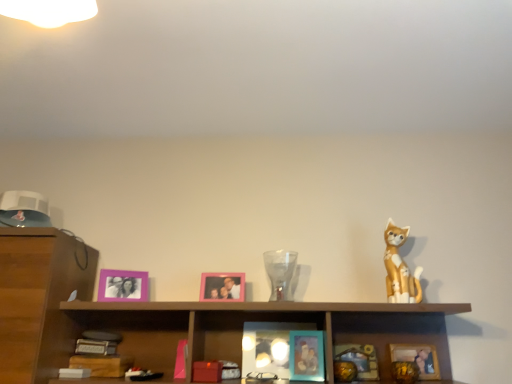
The width and height of the screenshot is (512, 384). Describe the element at coordinates (222, 286) in the screenshot. I see `pink matte picture frame at center, acting as the 2th picture frame starting from the left` at that location.

Where is `transparent glass vase at center`? This screenshot has height=384, width=512. transparent glass vase at center is located at coordinates (280, 273).

You are a GUI agent. You are given a task and a screenshot of the screen. Output one action in this format:
    pyautogui.click(x=<x>, y=<y>)
    Task: Click on the teal matte picture frame at lower center, marked as the 2th picture frame in a right-to-left arrangement
    The width and height of the screenshot is (512, 384).
    Given the screenshot: What is the action you would take?
    [359, 359]

Looking at this image, how much space does teal matte picture frame at lower center, marked as the 2th picture frame in a right-to-left arrangement, occupy vertically?

teal matte picture frame at lower center, marked as the 2th picture frame in a right-to-left arrangement, is 5.95 inches in height.

Based on the photo, what is the approximate width of matte orange cat figurine at right?

matte orange cat figurine at right is 3.23 inches wide.

The height and width of the screenshot is (384, 512). I want to click on pink matte picture frame at center, which is counted as the fourth picture frame, starting from the right, so click(222, 286).

Which of these two, pink matte picture frame at center, acting as the 2th picture frame starting from the left, or wooden picture frame at lower right, the first picture frame in the right-to-left sequence, is bigger?

wooden picture frame at lower right, the first picture frame in the right-to-left sequence.

Visually, is pink matte picture frame at center, which is counted as the fourth picture frame, starting from the right, positioned to the left or to the right of wooden picture frame at lower right, which appears as the 5th picture frame when viewed from the left?

In the image, pink matte picture frame at center, which is counted as the fourth picture frame, starting from the right, appears on the left side of wooden picture frame at lower right, which appears as the 5th picture frame when viewed from the left.

Considering the positions of point (237, 293) and point (430, 378), is point (237, 293) closer or farther from the camera than point (430, 378)?

Clearly, point (237, 293) is more distant from the camera than point (430, 378).

Considering the relative sizes of pink matte picture frame at center, which is counted as the fourth picture frame, starting from the right, and wooden picture frame at lower right, the first picture frame in the right-to-left sequence, in the image provided, is pink matte picture frame at center, which is counted as the fourth picture frame, starting from the right, taller than wooden picture frame at lower right, the first picture frame in the right-to-left sequence,?

No.

From the image's perspective, would you say teal matte picture frame at lower center, marked as the 2th picture frame in a right-to-left arrangement, is shown under transparent glass vase at center?

Correct, teal matte picture frame at lower center, marked as the 2th picture frame in a right-to-left arrangement, appears lower than transparent glass vase at center in the image.

Is the position of teal matte picture frame at lower center, which is counted as the 4th picture frame, starting from the left, less distant than that of transparent glass vase at center?

No.

Based on the photo, between teal matte picture frame at lower center, which is counted as the 4th picture frame, starting from the left, and transparent glass vase at center, which one has smaller width?

With smaller width is teal matte picture frame at lower center, which is counted as the 4th picture frame, starting from the left.

Is pink matte picture frame at center, acting as the 2th picture frame starting from the left, to the left or to the right of matte orange cat figurine at right in the image?

Clearly, pink matte picture frame at center, acting as the 2th picture frame starting from the left, is on the left of matte orange cat figurine at right in the image.

From a real-world perspective, who is located higher, pink matte picture frame at center, which is counted as the fourth picture frame, starting from the right, or matte orange cat figurine at right?

matte orange cat figurine at right.

Can you confirm if pink matte picture frame at center, acting as the 2th picture frame starting from the left, is wider than matte orange cat figurine at right?

In fact, pink matte picture frame at center, acting as the 2th picture frame starting from the left, might be narrower than matte orange cat figurine at right.

Is teal glossy picture frame at center, the third picture frame positioned from the right, looking in the opposite direction of purple matte picture frame at upper left, arranged as the first picture frame when viewed from the left?

teal glossy picture frame at center, the third picture frame positioned from the right, is not turned away from purple matte picture frame at upper left, arranged as the first picture frame when viewed from the left.

Is teal glossy picture frame at center, positioned as the third picture frame in left-to-right order, further to the viewer compared to purple matte picture frame at upper left, the fifth picture frame positioned from the right?

No, teal glossy picture frame at center, positioned as the third picture frame in left-to-right order, is in front of purple matte picture frame at upper left, the fifth picture frame positioned from the right.

Between teal glossy picture frame at center, positioned as the third picture frame in left-to-right order, and purple matte picture frame at upper left, the fifth picture frame positioned from the right, which one has larger width?

teal glossy picture frame at center, positioned as the third picture frame in left-to-right order, is wider.

From the image's perspective, is teal glossy picture frame at center, the third picture frame positioned from the right, under purple matte picture frame at upper left, arranged as the first picture frame when viewed from the left?

Yes, from the image's perspective, teal glossy picture frame at center, the third picture frame positioned from the right, is below purple matte picture frame at upper left, arranged as the first picture frame when viewed from the left.

Considering the sizes of objects teal matte picture frame at lower center, marked as the 2th picture frame in a right-to-left arrangement, and matte orange cat figurine at right in the image provided, who is bigger, teal matte picture frame at lower center, marked as the 2th picture frame in a right-to-left arrangement, or matte orange cat figurine at right?

matte orange cat figurine at right.

Could you tell me if teal matte picture frame at lower center, which is counted as the 4th picture frame, starting from the left, is turned towards matte orange cat figurine at right?

No, teal matte picture frame at lower center, which is counted as the 4th picture frame, starting from the left, does not turn towards matte orange cat figurine at right.

Between teal matte picture frame at lower center, marked as the 2th picture frame in a right-to-left arrangement, and matte orange cat figurine at right, which one has larger width?

Wider between the two is matte orange cat figurine at right.

Which object is further away from the camera taking this photo, teal matte picture frame at lower center, which is counted as the 4th picture frame, starting from the left, or matte orange cat figurine at right?

teal matte picture frame at lower center, which is counted as the 4th picture frame, starting from the left, is further from the camera.

Is teal glossy picture frame at center, positioned as the third picture frame in left-to-right order, at the back of transparent glass vase at center?

No, transparent glass vase at center is not facing the opposite direction of teal glossy picture frame at center, positioned as the third picture frame in left-to-right order.

Which object is further away from the camera, transparent glass vase at center or teal glossy picture frame at center, positioned as the third picture frame in left-to-right order?

transparent glass vase at center is more distant.

Which of these two, transparent glass vase at center or teal glossy picture frame at center, the third picture frame positioned from the right, is smaller?

Smaller between the two is teal glossy picture frame at center, the third picture frame positioned from the right.

Is transparent glass vase at center to the left of teal glossy picture frame at center, positioned as the third picture frame in left-to-right order, from the viewer's perspective?

Indeed, transparent glass vase at center is positioned on the left side of teal glossy picture frame at center, positioned as the third picture frame in left-to-right order.

Is point (396, 265) more distant than point (104, 294)?

No, it is in front of (104, 294).

Is matte orange cat figurine at right taller or shorter than purple matte picture frame at upper left, arranged as the first picture frame when viewed from the left?

matte orange cat figurine at right is taller than purple matte picture frame at upper left, arranged as the first picture frame when viewed from the left.

Considering the relative sizes of matte orange cat figurine at right and purple matte picture frame at upper left, the fifth picture frame positioned from the right, in the image provided, is matte orange cat figurine at right bigger than purple matte picture frame at upper left, the fifth picture frame positioned from the right,?

Yes, matte orange cat figurine at right is bigger than purple matte picture frame at upper left, the fifth picture frame positioned from the right.

Can you tell me how much matte orange cat figurine at right and purple matte picture frame at upper left, arranged as the first picture frame when viewed from the left, differ in facing direction?

The angle between the facing direction of matte orange cat figurine at right and the facing direction of purple matte picture frame at upper left, arranged as the first picture frame when viewed from the left, is 28.3 degrees.

From the image's perspective, count 4th picture frames downward from the pink matte picture frame at center, which is counted as the fourth picture frame, starting from the right, and point to it. Please provide its 2D coordinates.

[(418, 358)]

Identify the location of picture frame that is the 2nd object to the right of the transparent glass vase at center, starting at the anchor. (359, 359).

Consider the image. From the image, which object appears to be nearer to matte orange cat figurine at right, teal matte picture frame at lower center, which is counted as the 4th picture frame, starting from the left, or purple matte picture frame at upper left, arranged as the first picture frame when viewed from the left?

teal matte picture frame at lower center, which is counted as the 4th picture frame, starting from the left, is positioned closer to the anchor matte orange cat figurine at right.

When comparing their distances from transparent glass vase at center, does teal glossy picture frame at center, positioned as the third picture frame in left-to-right order, or pink matte picture frame at center, which is counted as the fourth picture frame, starting from the right, seem closer?

The object closer to transparent glass vase at center is pink matte picture frame at center, which is counted as the fourth picture frame, starting from the right.

Based on their spatial positions, is transparent glass vase at center or wooden cabinet at center closer to matte orange cat figurine at right?

wooden cabinet at center lies closer to matte orange cat figurine at right than the other object.

When comparing their distances from transparent glass vase at center, does pink matte picture frame at center, which is counted as the fourth picture frame, starting from the right, or matte orange cat figurine at right seem further?

matte orange cat figurine at right is positioned further to the anchor transparent glass vase at center.

Estimate the real-world distances between objects in this image. Which object is further from matte orange cat figurine at right, wooden cabinet at center or transparent glass vase at center?

Result: Based on the image, transparent glass vase at center appears to be further to matte orange cat figurine at right.

Considering their positions, is pink matte picture frame at center, which is counted as the fourth picture frame, starting from the right, positioned closer to wooden cabinet at center than teal matte picture frame at lower center, which is counted as the 4th picture frame, starting from the left?

Among the two, pink matte picture frame at center, which is counted as the fourth picture frame, starting from the right, is located nearer to wooden cabinet at center.

When comparing their distances from matte orange cat figurine at right, does purple matte picture frame at upper left, the fifth picture frame positioned from the right, or teal matte picture frame at lower center, marked as the 2th picture frame in a right-to-left arrangement, seem closer?

teal matte picture frame at lower center, marked as the 2th picture frame in a right-to-left arrangement, is positioned closer to the anchor matte orange cat figurine at right.

From the image, which object appears to be farther from matte orange cat figurine at right, teal matte picture frame at lower center, marked as the 2th picture frame in a right-to-left arrangement, or teal glossy picture frame at center, the third picture frame positioned from the right?

teal glossy picture frame at center, the third picture frame positioned from the right, is further to matte orange cat figurine at right.

This screenshot has width=512, height=384. I want to click on glass vase between pink matte picture frame at center, which is counted as the fourth picture frame, starting from the right, and matte orange cat figurine at right from left to right, so click(280, 273).

You are a GUI agent. You are given a task and a screenshot of the screen. Output one action in this format:
    pyautogui.click(x=<x>, y=<y>)
    Task: Click on the cabinet located between pink matte picture frame at center, acting as the 2th picture frame starting from the left, and matte orange cat figurine at right in the left-right direction
    This screenshot has width=512, height=384.
    Given the screenshot: What is the action you would take?
    pyautogui.click(x=259, y=321)

Find the location of a particular element. cabinet between transparent glass vase at center and teal glossy picture frame at center, positioned as the third picture frame in left-to-right order, in the vertical direction is located at coordinates (259, 321).

You are a GUI agent. You are given a task and a screenshot of the screen. Output one action in this format:
    pyautogui.click(x=<x>, y=<y>)
    Task: Click on the glass vase between purple matte picture frame at upper left, the fifth picture frame positioned from the right, and wooden picture frame at lower right, the first picture frame in the right-to-left sequence, from left to right
    The width and height of the screenshot is (512, 384).
    Given the screenshot: What is the action you would take?
    pyautogui.click(x=280, y=273)